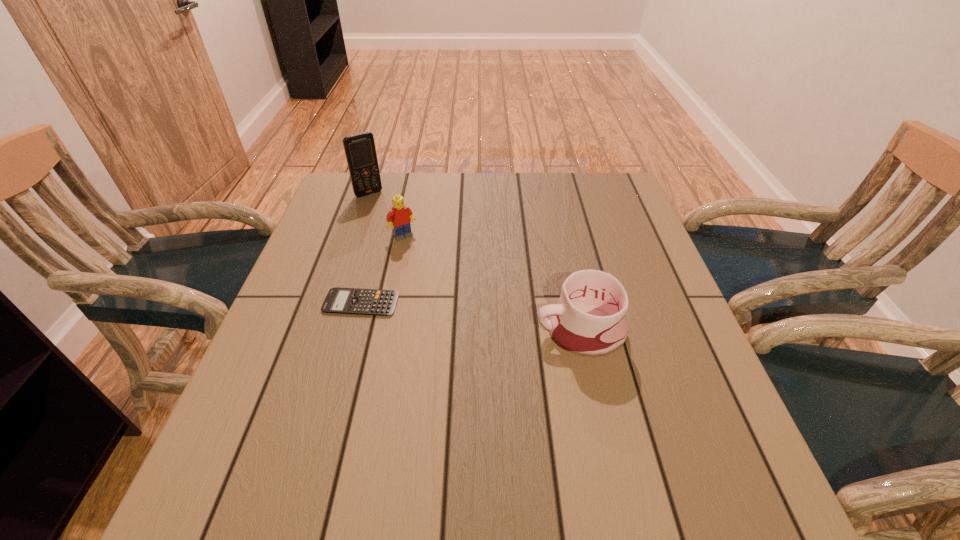
This screenshot has height=540, width=960. I want to click on the shortest object, so click(x=357, y=301).

Where is `the rightmost object`? the rightmost object is located at coordinates (589, 320).

This screenshot has width=960, height=540. I want to click on the third nearest object, so [x=401, y=216].

The image size is (960, 540). What are the coordinates of `the farthest object` in the screenshot? It's located at (360, 151).

The width and height of the screenshot is (960, 540). Find the location of `cellular telephone`. cellular telephone is located at coordinates (360, 151).

In order to click on vacant point located 0.200m on the back of the shortest object in this screenshot , I will do `click(378, 237)`.

You are a GUI agent. You are given a task and a screenshot of the screen. Output one action in this format:
    pyautogui.click(x=<x>, y=<y>)
    Task: Click on the vacant region located 0.070m on the side with the handle of the rightmost object
    The image size is (960, 540).
    Given the screenshot: What is the action you would take?
    pyautogui.click(x=503, y=331)

Locate an element on the screen. This screenshot has height=540, width=960. vacant area located on the side with the handle of the rightmost object is located at coordinates (348, 331).

You are a GUI agent. You are given a task and a screenshot of the screen. Output one action in this format:
    pyautogui.click(x=<x>, y=<y>)
    Task: Click on the vacant region located on the side with the handle of the rightmost object
    This screenshot has width=960, height=540.
    Given the screenshot: What is the action you would take?
    pyautogui.click(x=451, y=331)

This screenshot has width=960, height=540. What are the coordinates of `free space located on the front-facing side of the Lego` in the screenshot? It's located at (442, 284).